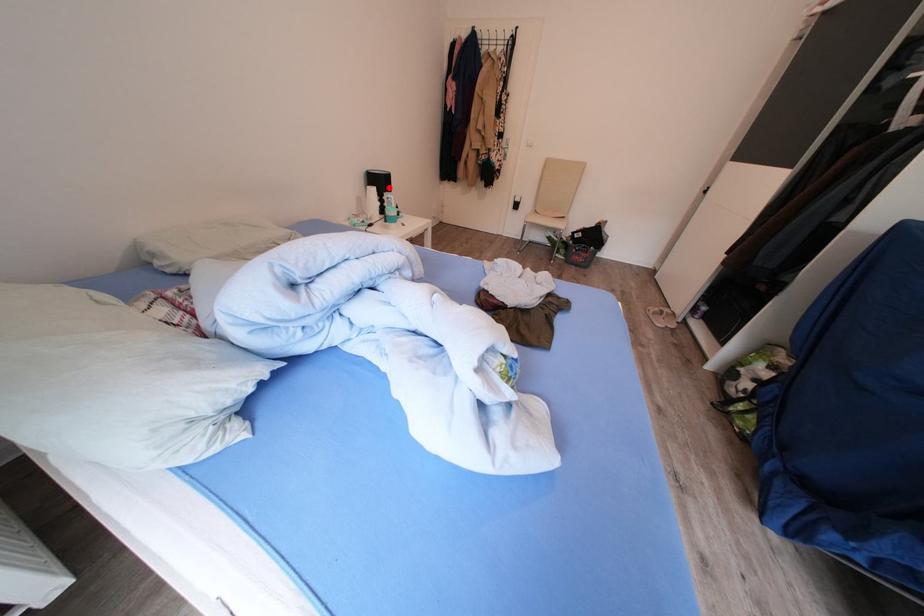
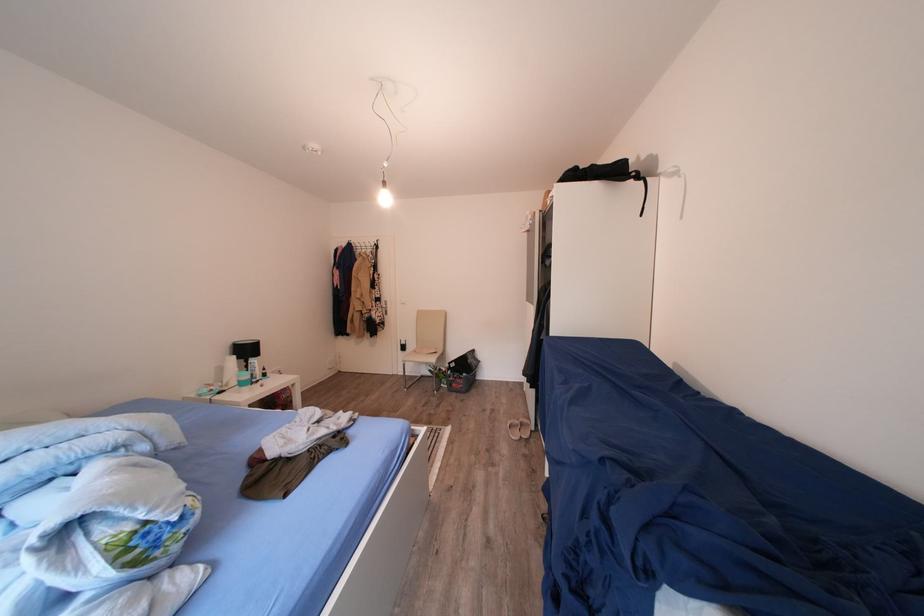
Locate, in the second image, the point that corresponds to the highlighted location in the first image.

(256, 355)